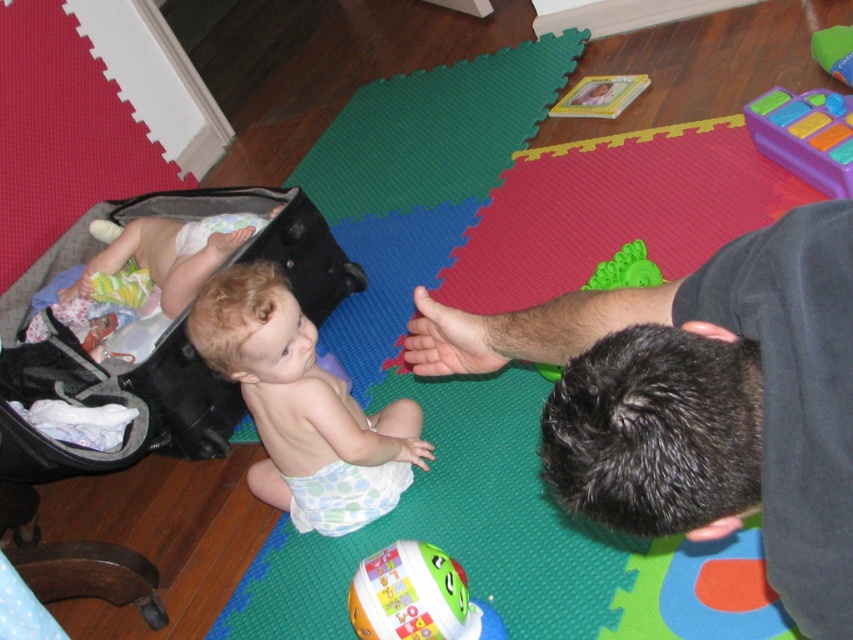
Can you confirm if light blue diaper at center is positioned to the right of light green dotted diaper at center?

Incorrect, light blue diaper at center is not on the right side of light green dotted diaper at center.

Does light blue diaper at center come in front of light green dotted diaper at center?

Yes, it is in front of light green dotted diaper at center.

Locate an element on the screen. light blue diaper at center is located at coordinates (302, 406).

In order to click on light blue diaper at center in this screenshot , I will do `click(302, 406)`.

Is black fabric baby carriage at left to the left of light blue diaper at center from the viewer's perspective?

Yes, black fabric baby carriage at left is to the left of light blue diaper at center.

From the picture: Does black fabric baby carriage at left have a lesser width compared to light blue diaper at center?

In fact, black fabric baby carriage at left might be wider than light blue diaper at center.

Find the location of a particular element. The height and width of the screenshot is (640, 853). black fabric baby carriage at left is located at coordinates (158, 342).

Is purple plastic toy at upper right bigger than light green dotted diaper at center?

Correct, purple plastic toy at upper right is larger in size than light green dotted diaper at center.

Does purple plastic toy at upper right appear over light green dotted diaper at center?

Correct, purple plastic toy at upper right is located above light green dotted diaper at center.

Is point (782, 147) closer to viewer compared to point (401, 483)?

No, it is behind (401, 483).

The height and width of the screenshot is (640, 853). What are the coordinates of `purple plastic toy at upper right` in the screenshot? It's located at (805, 134).